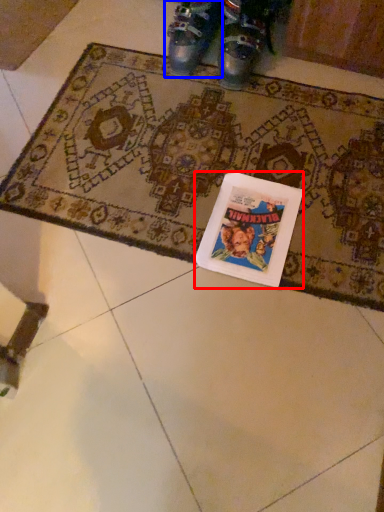
Question: Which point is closer to the camera, book cover (highlighted by a red box) or footwear (highlighted by a blue box)?

Choices:
 (A) book cover
 (B) footwear

Answer: (A)